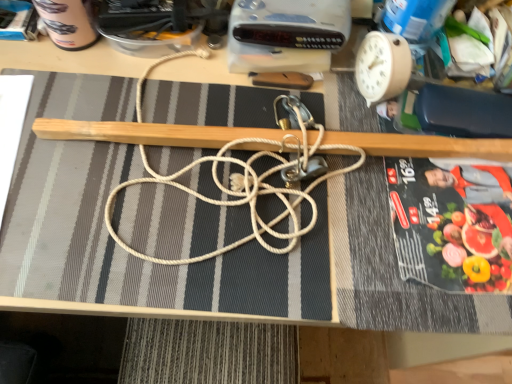
Question: In terms of size, does matte black paperback book at upper left, which appears as the 2th paperback book when viewed from the right, appear bigger or smaller than white rope at center?

Choices:
 (A) big
 (B) small

Answer: (B)

Question: In the image, is matte black paperback book at upper left, which appears as the 2th paperback book when viewed from the right, on the left side or the right side of white rope at center?

Choices:
 (A) right
 (B) left

Answer: (B)

Question: Estimate the real-world distances between objects in this image. Which object is closer to the white rope at center?

Choices:
 (A) black glossy paperback book at right, acting as the 2th paperback book starting from the left
 (B) matte black paperback book at upper left, the second paperback book when ordered from front to back
 (C) beige plastic clock at upper right

Answer: (A)

Question: Which object is the closest to the black glossy paperback book at right, acting as the 2th paperback book starting from the left?

Choices:
 (A) matte black paperback book at upper left, the first paperback book in the left-to-right sequence
 (B) beige plastic clock at upper right
 (C) white rope at center

Answer: (C)